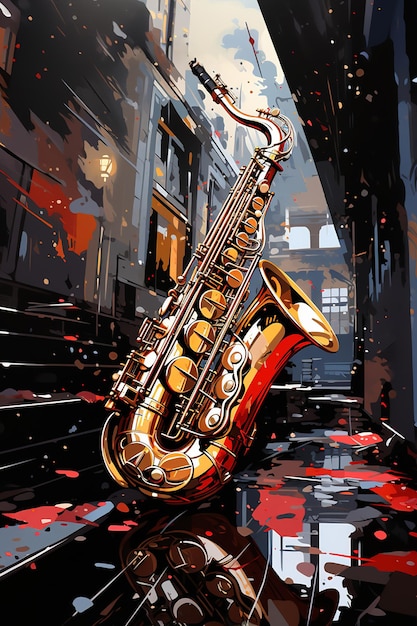
Locate an element on the screen. paneled window is located at coordinates (336, 295).